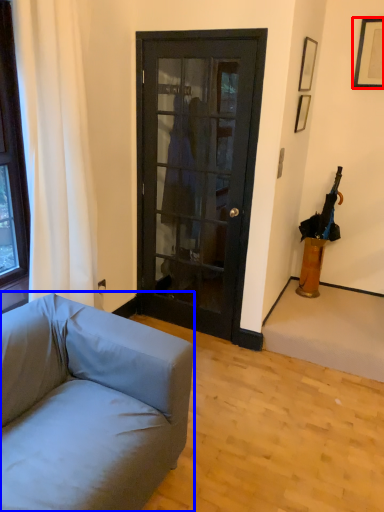
Question: Which object is closer to the camera taking this photo, picture frame (highlighted by a red box) or studio couch (highlighted by a blue box)?

Choices:
 (A) picture frame
 (B) studio couch

Answer: (B)